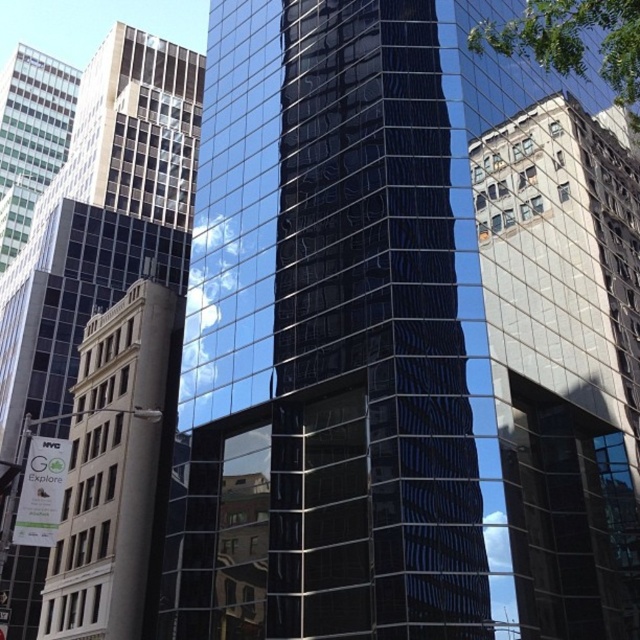
You are an architect evaluating the urban skyline. You notice the glossy glass tower at center and the reflective glass building at center. Which of these two structures has a greater overall size?

The glossy glass tower at center is larger in size than the reflective glass building at center.

You are an architect evaluating two buildings in the city. The glossy glass tower at center and the white stone tower at left are both visible. Which building has a larger overall size according to the scene?

The glossy glass tower at center is bigger than the white stone tower at left, so the glossy glass tower at center has a larger overall size.

You are standing at the point labeled point (564, 360) in the image. Which building are you facing? The reflective glass building at center or the traditional beige building to the left?

You are facing the reflective glass building at center because the point (564, 360) represents that building.